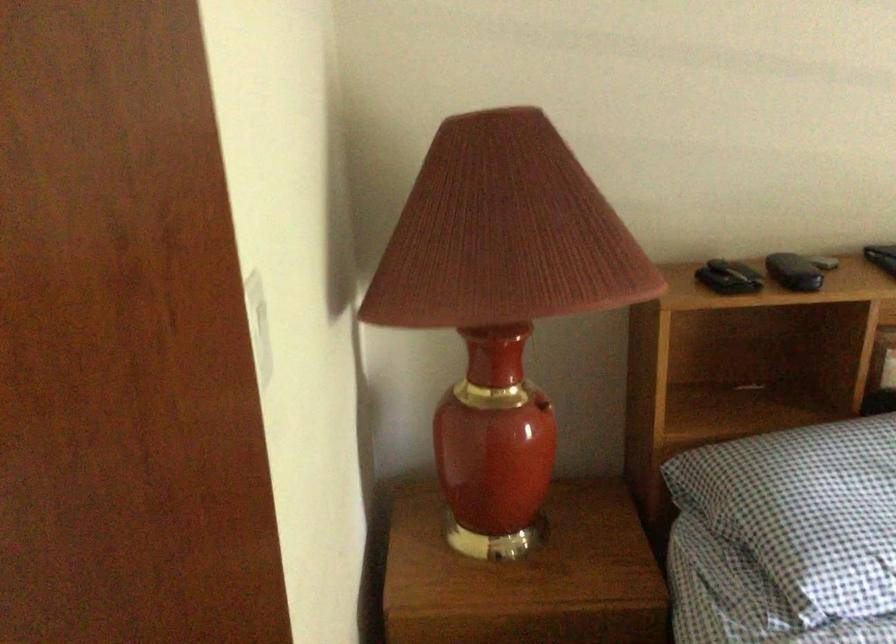
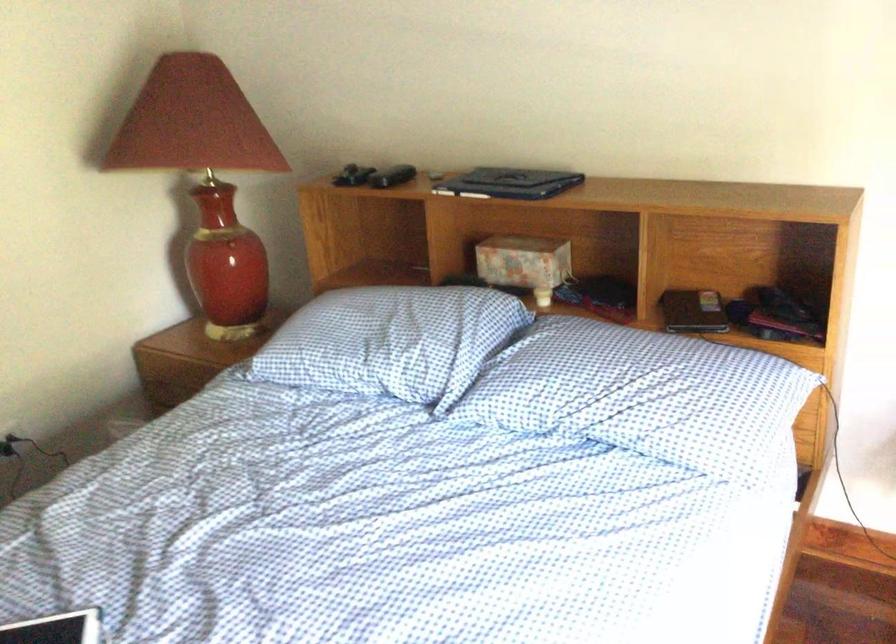
Find the pixel in the second image that matches [755,285] in the first image.

(352, 176)